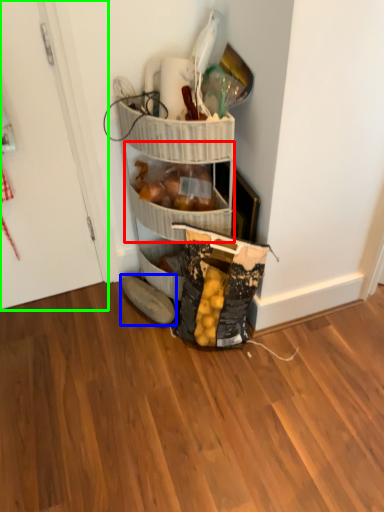
Question: Which object is the closest to the basket (highlighted by a red box)? Choose among these: footwear (highlighted by a blue box) or door (highlighted by a green box).

Choices:
 (A) footwear
 (B) door

Answer: (A)